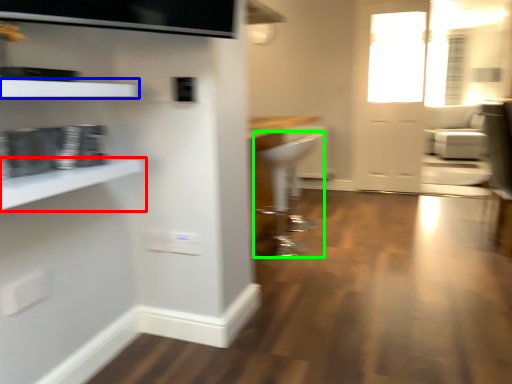
Question: Which is farther away from shelf (highlighted by a red box)? shelf (highlighted by a blue box) or armchair (highlighted by a green box)?

Choices:
 (A) shelf
 (B) armchair

Answer: (B)